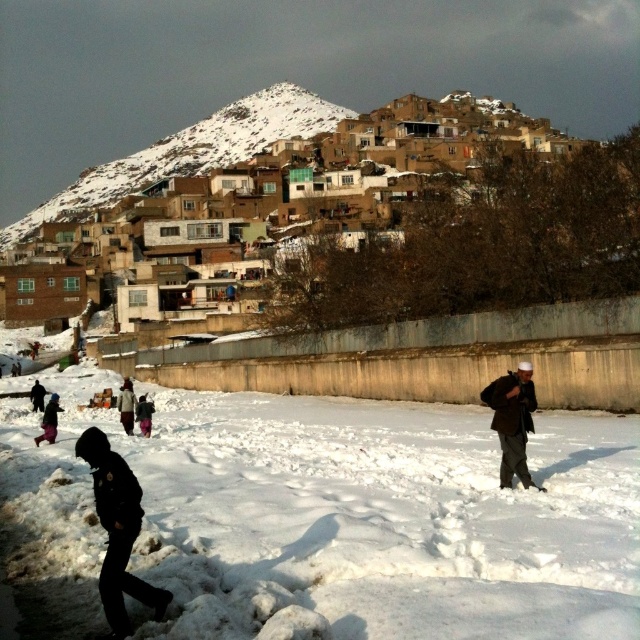
Question: Which point is closer to the camera taking this photo?

Choices:
 (A) (124, 420)
 (B) (138, 397)

Answer: (A)

Question: Among these points, which one is nearest to the camera?

Choices:
 (A) (248, 99)
 (B) (132, 556)
 (C) (150, 422)
 (D) (132, 408)

Answer: (B)

Question: Which point is closer to the camera?

Choices:
 (A) pink fabric pants at lower left
 (B) brown clay houses at upper center
 (C) dark brown woolen coat at lower left

Answer: (A)

Question: Can you confirm if dark brown leather bag at lower right is positioned above dark brown woolen coat at lower left?

Choices:
 (A) yes
 (B) no

Answer: (A)

Question: Is pink fabric pants at lower left closer to camera compared to dark brown woolen coat at lower left?

Choices:
 (A) no
 (B) yes

Answer: (B)

Question: Is dark brown jacket at lower left bigger than dark brown woolen coat at lower left?

Choices:
 (A) no
 (B) yes

Answer: (B)